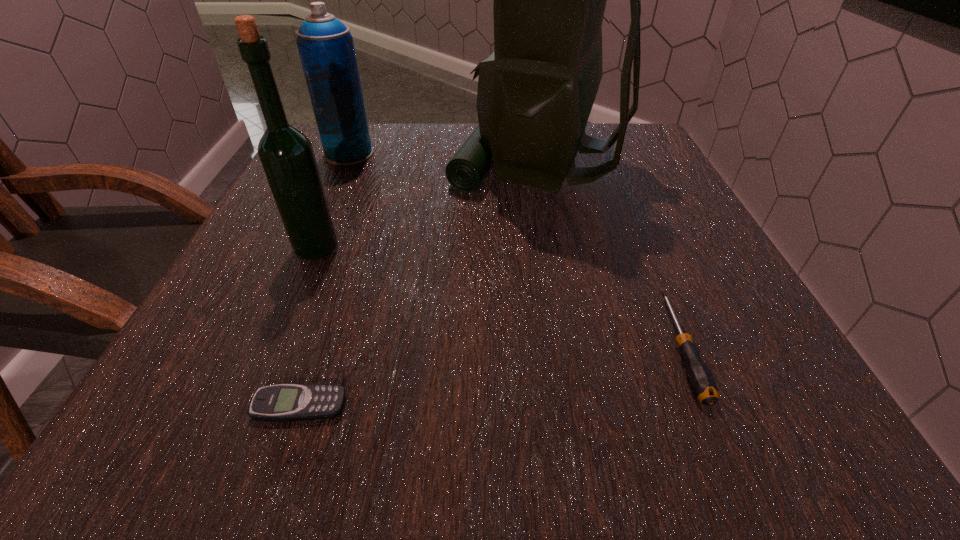
Identify the location of free space located on the right of the third tallest object. This screenshot has width=960, height=540. (404, 154).

This screenshot has width=960, height=540. I want to click on free space located on the left of the screwdriver, so click(516, 348).

Where is `vacant area situated on the back of the shortest object`? vacant area situated on the back of the shortest object is located at coordinates (348, 260).

Find the location of a particular element. The height and width of the screenshot is (540, 960). backpack that is at the far edge is located at coordinates (535, 93).

The height and width of the screenshot is (540, 960). Find the location of `aerosol can that is positioned at the far edge`. aerosol can that is positioned at the far edge is located at coordinates (325, 45).

Where is `screwdriver at the near edge`? The image size is (960, 540). screwdriver at the near edge is located at coordinates [701, 380].

You are a GUI agent. You are given a task and a screenshot of the screen. Output one action in this format:
    pyautogui.click(x=<x>, y=<y>)
    Task: Click on the beeper that is at the near edge
    Image resolution: width=960 pixels, height=540 pixels.
    Given the screenshot: What is the action you would take?
    pos(283,402)

I want to click on liquor that is at the left edge, so click(x=287, y=157).

I want to click on aerosol can located in the left edge section of the desktop, so click(325, 45).

I want to click on beeper positioned at the left edge, so click(283, 402).